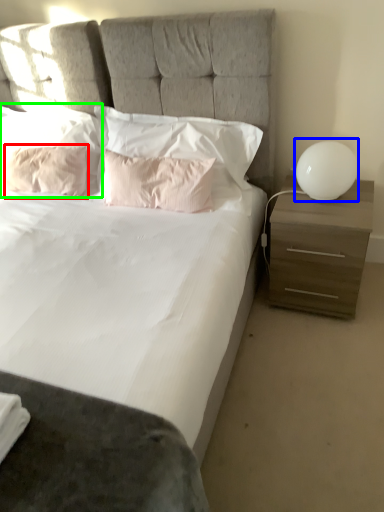
Question: Which is farther away from pillow (highlighted by a red box)? table lamp (highlighted by a blue box) or pillow (highlighted by a green box)?

Choices:
 (A) table lamp
 (B) pillow

Answer: (A)